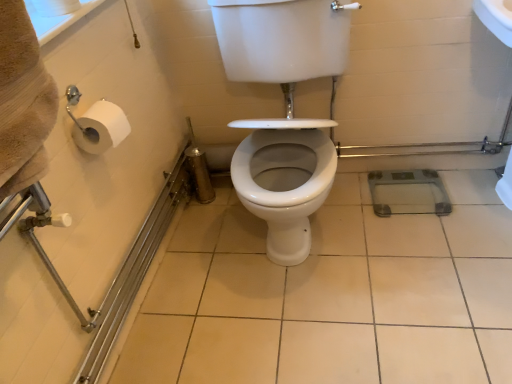
Find the location of `vacant area on top of white glossy ceramic tile at center (from a real-world perspective)`. vacant area on top of white glossy ceramic tile at center (from a real-world perspective) is located at coordinates (334, 285).